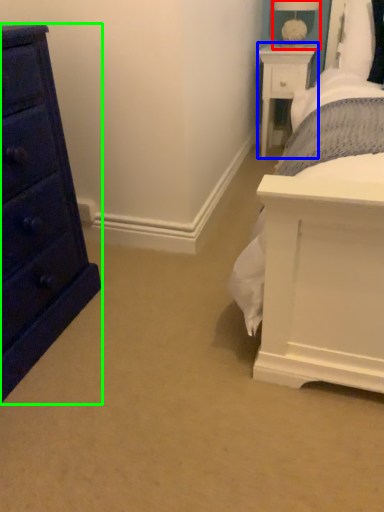
Question: Which is nearer to the table lamp (highlighted by a red box)? nightstand (highlighted by a blue box) or chest of drawers (highlighted by a green box).

Choices:
 (A) nightstand
 (B) chest of drawers

Answer: (A)